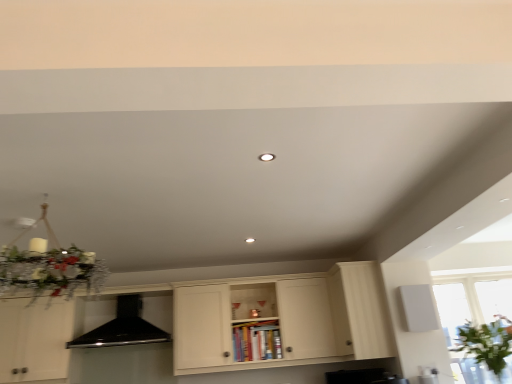
This screenshot has height=384, width=512. Identify the location of transparent glass window at lower right. (471, 300).

Find the location of `matte white cabinet at center, the 2th cabinetry when ordered from right to left`. matte white cabinet at center, the 2th cabinetry when ordered from right to left is located at coordinates (280, 318).

This screenshot has width=512, height=384. What do you see at coordinates (358, 311) in the screenshot?
I see `white wood cabinet at right, the second cabinetry positioned from the left` at bounding box center [358, 311].

At what (x,y) coordinates should I click in order to perform the action: click on transparent glass window at lower right. Please return your answer as a coordinate pair (x, y). Image resolution: width=512 pixels, height=384 pixels. Looking at the image, I should click on (471, 300).

Considering the relative positions of black matte exhaust hood at center and matte white cabinet at center, positioned as the 1th cabinetry in left-to-right order, in the image provided, is black matte exhaust hood at center behind matte white cabinet at center, positioned as the 1th cabinetry in left-to-right order,?

Yes, the depth of black matte exhaust hood at center is greater than that of matte white cabinet at center, positioned as the 1th cabinetry in left-to-right order.

From a real-world perspective, is black matte exhaust hood at center on top of matte white cabinet at center, the 2th cabinetry when ordered from right to left?

Yes.

From the image's perspective, is black matte exhaust hood at center above or below matte white cabinet at center, positioned as the 1th cabinetry in left-to-right order?

Based on their image positions, black matte exhaust hood at center is located above matte white cabinet at center, positioned as the 1th cabinetry in left-to-right order.

Who is smaller, black matte exhaust hood at center or matte white cabinet at center, the 2th cabinetry when ordered from right to left?

black matte exhaust hood at center.

From a real-world perspective, is white wood cabinet at right, the second cabinetry positioned from the left, located higher than black matte exhaust hood at center?

Incorrect, from a real-world perspective, white wood cabinet at right, the second cabinetry positioned from the left, is lower than black matte exhaust hood at center.

From the image's perspective, which one is positioned higher, white wood cabinet at right, the second cabinetry positioned from the left, or black matte exhaust hood at center?

white wood cabinet at right, the second cabinetry positioned from the left.

Which of these two, white wood cabinet at right, the second cabinetry positioned from the left, or black matte exhaust hood at center, stands taller?

With more height is white wood cabinet at right, the second cabinetry positioned from the left.

From the image's perspective, is black matte exhaust hood at center on top of transparent glass window at lower right?

No, from the image's perspective, black matte exhaust hood at center is not over transparent glass window at lower right.

From a real-world perspective, is black matte exhaust hood at center beneath transparent glass window at lower right?

No, from a real-world perspective, black matte exhaust hood at center is not beneath transparent glass window at lower right.

Is black matte exhaust hood at center touching transparent glass window at lower right?

No.

Which is less distant, (97, 331) or (483, 315)?

Point (97, 331).

Looking at the image, does white wood cabinet at right, the second cabinetry positioned from the left, seem bigger or smaller compared to matte white cabinet at center, the 2th cabinetry when ordered from right to left?

Considering their sizes, white wood cabinet at right, the second cabinetry positioned from the left, takes up less space than matte white cabinet at center, the 2th cabinetry when ordered from right to left.

Is point (372, 269) behind point (346, 272)?

Yes, point (372, 269) is behind point (346, 272).

Is there a large distance between white wood cabinet at right, the second cabinetry positioned from the left, and matte white cabinet at center, the 2th cabinetry when ordered from right to left?

white wood cabinet at right, the second cabinetry positioned from the left, is actually quite close to matte white cabinet at center, the 2th cabinetry when ordered from right to left.

Can you tell me how much white wood cabinet at right, positioned as the first cabinetry in right-to-left order, and matte white cabinet at center, positioned as the 1th cabinetry in left-to-right order, differ in facing direction?

The angular difference between white wood cabinet at right, positioned as the first cabinetry in right-to-left order, and matte white cabinet at center, positioned as the 1th cabinetry in left-to-right order, is 89.2 degrees.

Between transparent glass window at lower right and black matte exhaust hood at center, which one has less height?

With less height is transparent glass window at lower right.

Consider the image. Is transparent glass window at lower right inside the boundaries of black matte exhaust hood at center, or outside?

transparent glass window at lower right is not inside black matte exhaust hood at center, it's outside.

Can you tell me how much transparent glass window at lower right and black matte exhaust hood at center differ in facing direction?

There is a 90.7-degree angle between the facing directions of transparent glass window at lower right and black matte exhaust hood at center.

Which is less distant, (370,331) or (467,304)?

Clearly, point (370,331) is closer to the camera than point (467,304).

Is white wood cabinet at right, the second cabinetry positioned from the left, inside the boundaries of transparent glass window at lower right, or outside?

The correct answer is: outside.

Is white wood cabinet at right, positioned as the first cabinetry in right-to-left order, oriented towards transparent glass window at lower right?

No, white wood cabinet at right, positioned as the first cabinetry in right-to-left order, is not aimed at transparent glass window at lower right.

Between white wood cabinet at right, the second cabinetry positioned from the left, and transparent glass window at lower right, which one has larger width?

Wider between the two is white wood cabinet at right, the second cabinetry positioned from the left.

Is matte white cabinet at center, the 2th cabinetry when ordered from right to left, surrounding transparent glass window at lower right?

Definitely not — transparent glass window at lower right is not inside matte white cabinet at center, the 2th cabinetry when ordered from right to left.

Is matte white cabinet at center, positioned as the 1th cabinetry in left-to-right order, in contact with transparent glass window at lower right?

There is a gap between matte white cabinet at center, positioned as the 1th cabinetry in left-to-right order, and transparent glass window at lower right.

From the image's perspective, which one is positioned lower, matte white cabinet at center, positioned as the 1th cabinetry in left-to-right order, or transparent glass window at lower right?

matte white cabinet at center, positioned as the 1th cabinetry in left-to-right order.

The height and width of the screenshot is (384, 512). I want to click on exhaust hood that appears behind the matte white cabinet at center, positioned as the 1th cabinetry in left-to-right order, so click(122, 328).

The height and width of the screenshot is (384, 512). In the image, there is a black matte exhaust hood at center. What are the coordinates of `cabinetry above it (from the image's perspective)` in the screenshot? It's located at tap(358, 311).

From the image, which object appears to be farther from white wood cabinet at right, positioned as the first cabinetry in right-to-left order, matte white cabinet at center, the 2th cabinetry when ordered from right to left, or black matte exhaust hood at center?

Based on the image, black matte exhaust hood at center appears to be further to white wood cabinet at right, positioned as the first cabinetry in right-to-left order.

From the image, which object appears to be farther from black matte exhaust hood at center, transparent glass window at lower right or matte white cabinet at center, positioned as the 1th cabinetry in left-to-right order?

transparent glass window at lower right is positioned further to the anchor black matte exhaust hood at center.

Looking at the image, which one is located further to transparent glass window at lower right, black matte exhaust hood at center or matte white cabinet at center, positioned as the 1th cabinetry in left-to-right order?

black matte exhaust hood at center lies further to transparent glass window at lower right than the other object.

From the image, which object appears to be nearer to matte white cabinet at center, positioned as the 1th cabinetry in left-to-right order, transparent glass window at lower right or black matte exhaust hood at center?

black matte exhaust hood at center is positioned closer to the anchor matte white cabinet at center, positioned as the 1th cabinetry in left-to-right order.

Looking at the image, which one is located closer to black matte exhaust hood at center, matte white cabinet at center, positioned as the 1th cabinetry in left-to-right order, or white wood cabinet at right, positioned as the first cabinetry in right-to-left order?

Based on the image, matte white cabinet at center, positioned as the 1th cabinetry in left-to-right order, appears to be nearer to black matte exhaust hood at center.

Looking at the image, which one is located further to matte white cabinet at center, the 2th cabinetry when ordered from right to left, black matte exhaust hood at center or white wood cabinet at right, positioned as the first cabinetry in right-to-left order?

The object further to matte white cabinet at center, the 2th cabinetry when ordered from right to left, is black matte exhaust hood at center.

Looking at the image, which one is located further to matte white cabinet at center, positioned as the 1th cabinetry in left-to-right order, transparent glass window at lower right or white wood cabinet at right, positioned as the first cabinetry in right-to-left order?

transparent glass window at lower right.

Which object lies nearer to the anchor point transparent glass window at lower right, white wood cabinet at right, the second cabinetry positioned from the left, or matte white cabinet at center, the 2th cabinetry when ordered from right to left?

white wood cabinet at right, the second cabinetry positioned from the left, is closer to transparent glass window at lower right.

The width and height of the screenshot is (512, 384). In order to click on cabinetry between black matte exhaust hood at center and white wood cabinet at right, the second cabinetry positioned from the left in this screenshot , I will do `click(280, 318)`.

Locate an element on the screen. cabinetry between matte white cabinet at center, positioned as the 1th cabinetry in left-to-right order, and transparent glass window at lower right is located at coordinates (358, 311).